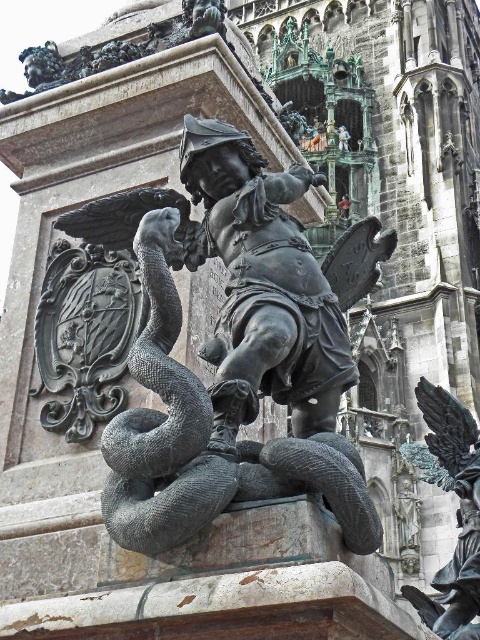
Looking at this image, you are an art conservator examining the bronze statue mounted on the stone pedestal. You notice two specific points on the statue labeled as point 1 at coordinates point (144, 412) and point 2 at coordinates point (432, 388). If you were to clean these points, which one would you reach first without moving your position?

Point (144, 412) is closer to the viewer than point (432, 388), so you would reach point (144, 412) first.

What is the significance of the point marked at coordinates (206, 442) in the image?

The point marked at coordinates (206, 442) indicates the location of the polished bronze snake at center in the statue.